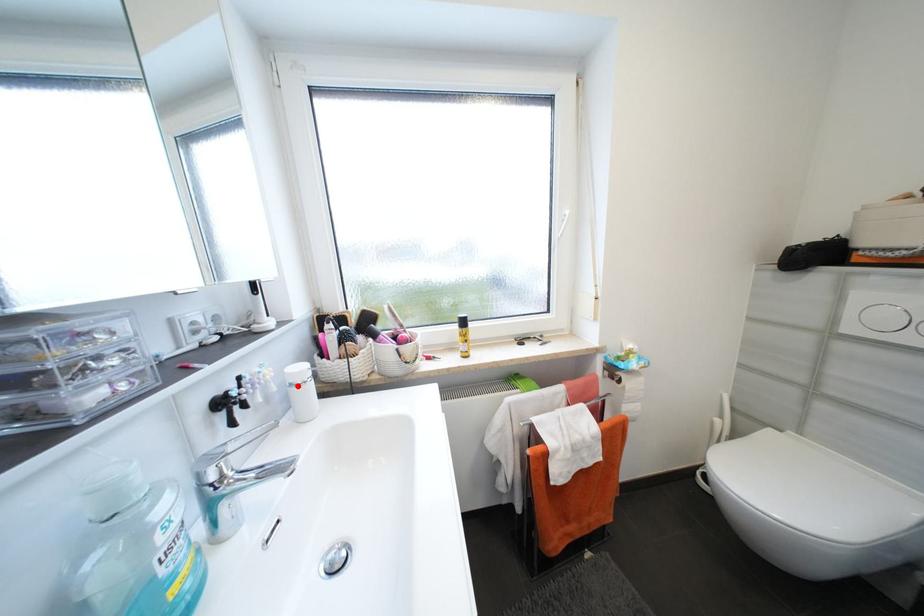
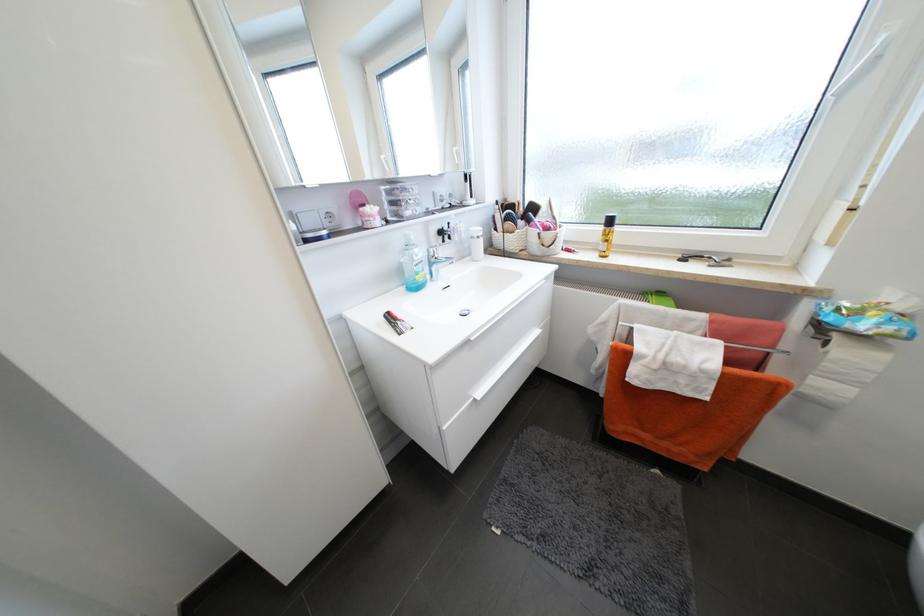
In the second image, find the point that corresponds to the highlighted location in the first image.

(478, 238)